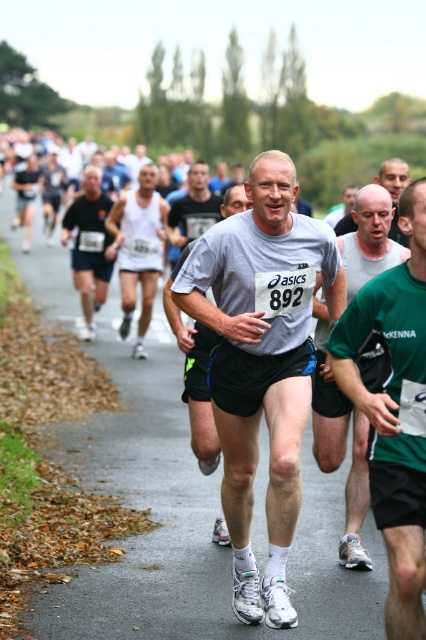
You are a photographer at the race. You want to take a photo of the white matte tank top at center and the matte black shorts at left. Which object will appear bigger in your photo?

The white matte tank top at center will appear bigger in the photo because it is larger in size than the matte black shorts at left.

You are a photographer at the race and want to capture a closeup of the green fabric shirt at center and smooth gray shirt at center. Which shirt should you zoom in on to ensure it fits entirely within your camera frame if your frame can only accommodate the width of the narrower shirt?

The green fabric shirt at center has a smaller width than the smooth gray shirt at center. Since the camera frame can only accommodate the narrower shirt, you should zoom in on the green fabric shirt at center to ensure it fits entirely within the frame.

You are a photographer trying to capture the runner in the gray Asics shirt with the number 892. The point you need to focus on is at coordinates point (138, 248). What object is located at this point?

The point (138, 248) corresponds to the white matte tank top at center.